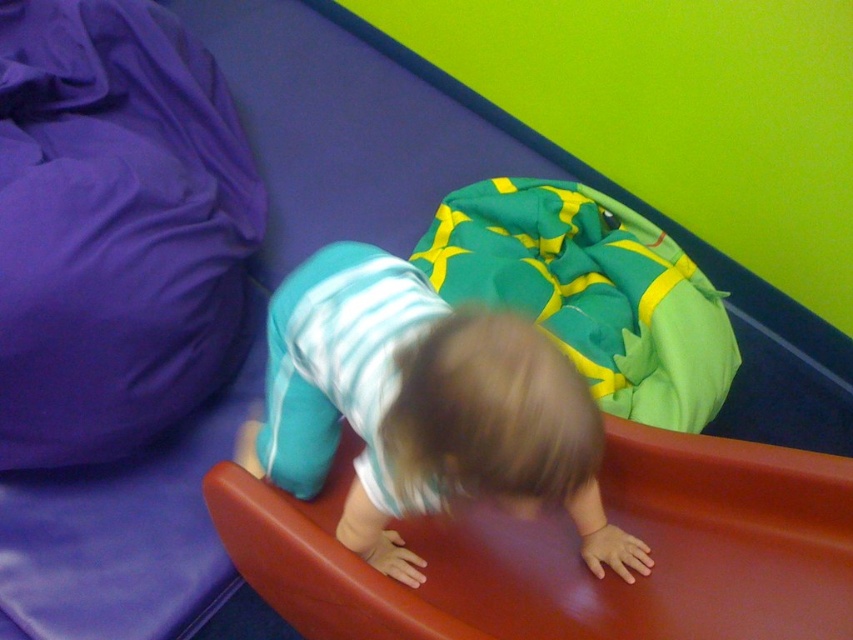
You are a parent watching your child play in a soft play area. You notice the smooth red slide at lower center and the teal striped shirt at center. Which object is closer to the ground?

The smooth red slide at lower center is positioned under the teal striped shirt at center, so it is closer to the ground.

You are a parent trying to decide if your child can reach the top of the smooth red slide at lower center while wearing the teal striped shirt at center. Based on their sizes, can the child climb up the slide?

The smooth red slide at lower center is shorter than the teal striped shirt at center, which suggests the slide is too short for the child to climb up safely.